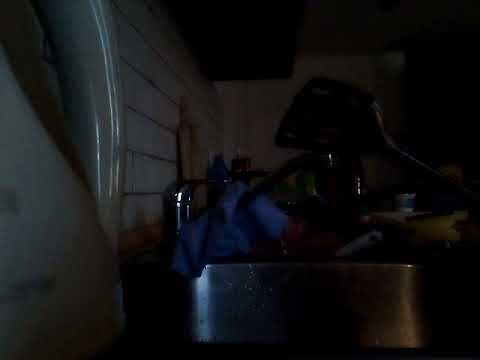
Locate an element on the screen. This screenshot has width=480, height=360. jug is located at coordinates (54, 283).